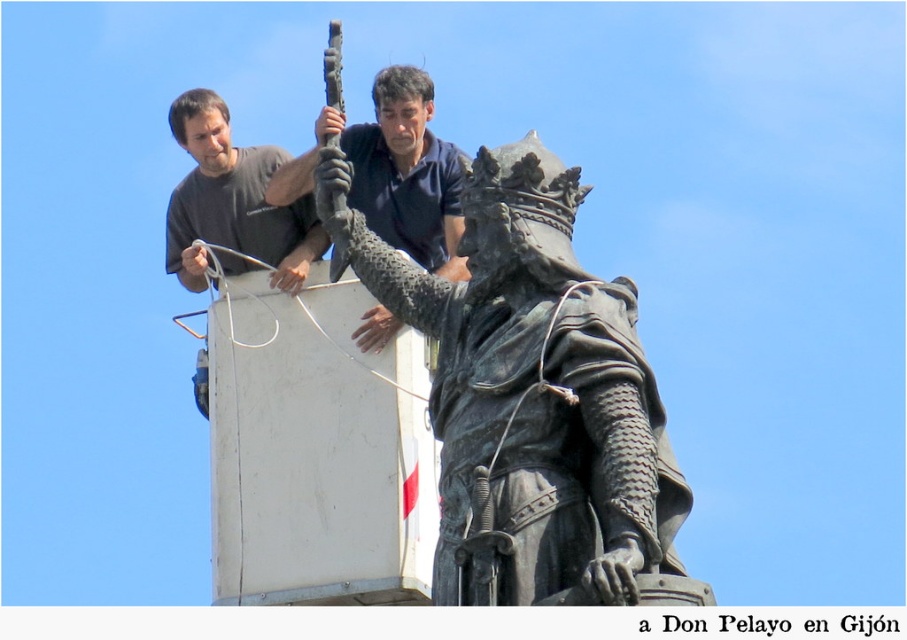
Question: Which object is farther from the camera taking this photo?

Choices:
 (A) matte black shirt at upper center
 (B) matte gray shirt at upper left

Answer: (B)

Question: Which object is closer to the camera taking this photo?

Choices:
 (A) bronze statue at center
 (B) matte black shirt at upper center
 (C) matte gray shirt at upper left

Answer: (A)

Question: Does matte gray shirt at upper left have a greater width compared to matte black shirt at upper center?

Choices:
 (A) yes
 (B) no

Answer: (A)

Question: Can you confirm if matte gray shirt at upper left is positioned to the right of matte black shirt at upper center?

Choices:
 (A) no
 (B) yes

Answer: (A)

Question: Can you confirm if matte gray shirt at upper left is positioned above matte black shirt at upper center?

Choices:
 (A) yes
 (B) no

Answer: (A)

Question: Which point is farther to the camera?

Choices:
 (A) matte gray shirt at upper left
 (B) bronze statue at center

Answer: (A)